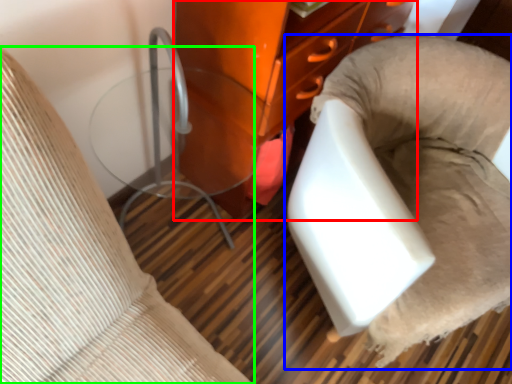
Question: Estimate the real-world distances between objects in this image. Which object is farther from furniture (highlighted by a red box), furniture (highlighted by a blue box) or furniture (highlighted by a green box)?

Choices:
 (A) furniture
 (B) furniture

Answer: (B)